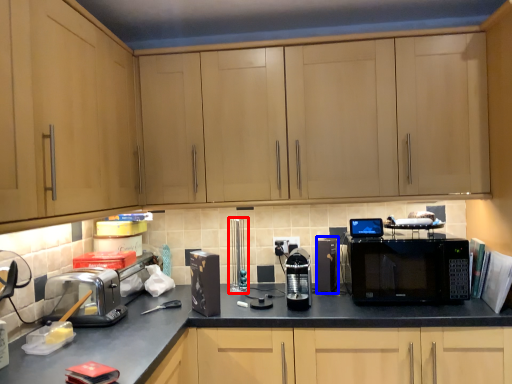
Question: Which of the following is the farthest to the observer, appliance (highlighted by a red box) or appliance (highlighted by a blue box)?

Choices:
 (A) appliance
 (B) appliance

Answer: (A)